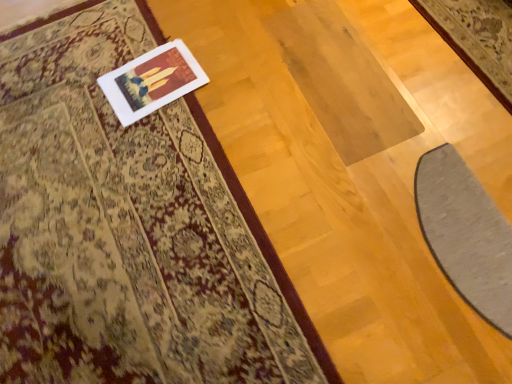
What are the coordinates of `unoccupied space behind white matte picture frame at upper left` in the screenshot? It's located at (129, 35).